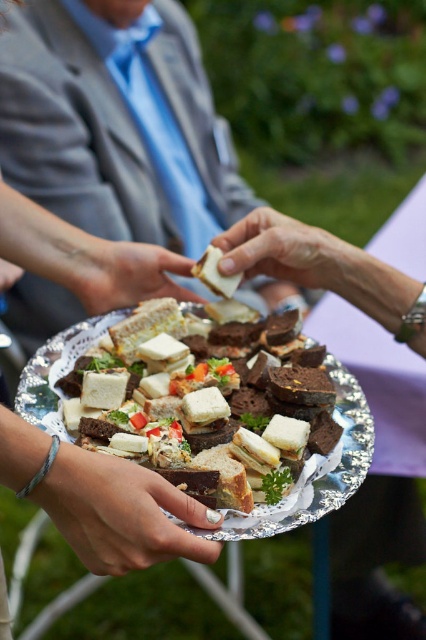
You are holding a tray with two points marked on it. The points are labeled as point [268,218] and point [118,268]. If you want to place a decorative sticker closer to the viewer, which point should you choose?

Point [268,218] is closer to the viewer than point [118,268], so you should place the decorative sticker on point [268,218].

You are arranging a tea party and need to place the white matte sandwich at center onto the satin silver tray at lower center. Considering their sizes, will the sandwich fit on the tray?

The satin silver tray at lower center has a lesser width compared to white matte sandwich at center, so the sandwich will not fit on the tray.